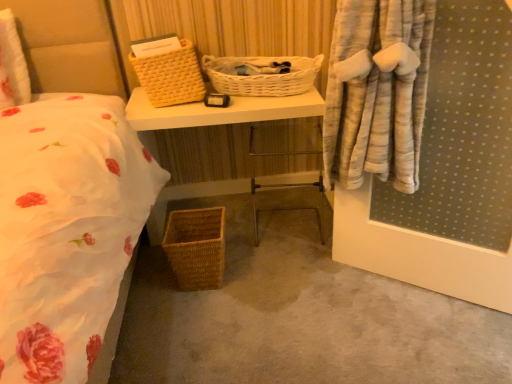
What do you see at coordinates (282, 180) in the screenshot? The width and height of the screenshot is (512, 384). I see `metallic silver chair at center` at bounding box center [282, 180].

This screenshot has height=384, width=512. What do you see at coordinates (196, 247) in the screenshot?
I see `woven brown picnic basket at lower center, the third picnic basket viewed from the top` at bounding box center [196, 247].

The height and width of the screenshot is (384, 512). What do you see at coordinates (218, 112) in the screenshot? I see `matte wicker basket at center` at bounding box center [218, 112].

What is the approximate height of matte wicker basket at center?

matte wicker basket at center is 65.58 centimeters tall.

What do you see at coordinates (170, 76) in the screenshot?
I see `yellow woven picnic basket at upper center, the 3th picnic basket positioned from the bottom` at bounding box center [170, 76].

Image resolution: width=512 pixels, height=384 pixels. Identify the location of metallic silver chair at center. (282, 180).

Is the depth of woven brown picnic basket at lower center, the third picnic basket viewed from the top, greater than that of matte wicker basket at center?

No, woven brown picnic basket at lower center, the third picnic basket viewed from the top, is closer to the viewer.

Does woven brown picnic basket at lower center, the 1th picnic basket from the bottom, have a smaller size compared to matte wicker basket at center?

Indeed, woven brown picnic basket at lower center, the 1th picnic basket from the bottom, has a smaller size compared to matte wicker basket at center.

Considering the relative sizes of woven brown picnic basket at lower center, the 1th picnic basket from the bottom, and matte wicker basket at center in the image provided, is woven brown picnic basket at lower center, the 1th picnic basket from the bottom, shorter than matte wicker basket at center?

Correct, woven brown picnic basket at lower center, the 1th picnic basket from the bottom, is not as tall as matte wicker basket at center.

From a real-world perspective, between woven brown picnic basket at lower center, the 1th picnic basket from the bottom, and matte wicker basket at center, who is vertically higher?

matte wicker basket at center.

Choose the correct answer: Is yellow woven picnic basket at upper center, the 1th picnic basket positioned from the top, inside white wicker picnic basket at center, marked as the second picnic basket in a bottom-to-top arrangement, or outside it?

yellow woven picnic basket at upper center, the 1th picnic basket positioned from the top, is spatially situated outside white wicker picnic basket at center, marked as the second picnic basket in a bottom-to-top arrangement.

What are the coordinates of `the 2nd picnic basket counting from the right side of the yellow woven picnic basket at upper center, the 3th picnic basket positioned from the bottom` in the screenshot? It's located at (261, 76).

Based on their sizes in the image, would you say yellow woven picnic basket at upper center, the 1th picnic basket positioned from the top, is bigger or smaller than white wicker picnic basket at center, the second picnic basket when ordered from top to bottom?

In the image, yellow woven picnic basket at upper center, the 1th picnic basket positioned from the top, appears to be larger than white wicker picnic basket at center, the second picnic basket when ordered from top to bottom.

Considering the relative sizes of yellow woven picnic basket at upper center, the 3th picnic basket positioned from the bottom, and white wicker picnic basket at center, marked as the second picnic basket in a bottom-to-top arrangement, in the image provided, is yellow woven picnic basket at upper center, the 3th picnic basket positioned from the bottom, taller than white wicker picnic basket at center, marked as the second picnic basket in a bottom-to-top arrangement,?

Yes.

Considering the sizes of objects woven basket at lower left and woven brown picnic basket at lower center, the 1th picnic basket from the bottom, in the image provided, who is smaller, woven basket at lower left or woven brown picnic basket at lower center, the 1th picnic basket from the bottom,?

With smaller size is woven brown picnic basket at lower center, the 1th picnic basket from the bottom.

Is woven basket at lower left next to woven brown picnic basket at lower center, the third picnic basket viewed from the top, and touching it?

woven basket at lower left is not next to woven brown picnic basket at lower center, the third picnic basket viewed from the top, and they're not touching.

Which point is more distant from viewer, (181,328) or (212,236)?

Point (212,236)

From a real-world perspective, is woven basket at lower left below woven brown picnic basket at lower center, the 1th picnic basket from the bottom?

Indeed, from a real-world perspective, woven basket at lower left is positioned beneath woven brown picnic basket at lower center, the 1th picnic basket from the bottom.

Where is `concrete below the yellow woven picnic basket at upper center, the 1th picnic basket positioned from the top (from the image's perspective)`? This screenshot has width=512, height=384. concrete below the yellow woven picnic basket at upper center, the 1th picnic basket positioned from the top (from the image's perspective) is located at coordinates (298, 317).

Is woven basket at lower left not within yellow woven picnic basket at upper center, the 3th picnic basket positioned from the bottom?

Yes, woven basket at lower left is located beyond the bounds of yellow woven picnic basket at upper center, the 3th picnic basket positioned from the bottom.

Considering the sizes of objects woven basket at lower left and yellow woven picnic basket at upper center, the 3th picnic basket positioned from the bottom, in the image provided, who is shorter, woven basket at lower left or yellow woven picnic basket at upper center, the 3th picnic basket positioned from the bottom,?

woven basket at lower left.

Looking at this image, can you see matte wicker basket at center touching woven brown picnic basket at lower center, the third picnic basket viewed from the top?

No, matte wicker basket at center is not beside woven brown picnic basket at lower center, the third picnic basket viewed from the top.

From the picture: Can you confirm if matte wicker basket at center is smaller than woven brown picnic basket at lower center, the 1th picnic basket from the bottom?

Actually, matte wicker basket at center might be larger than woven brown picnic basket at lower center, the 1th picnic basket from the bottom.

From the image's perspective, is matte wicker basket at center under woven brown picnic basket at lower center, the 1th picnic basket from the bottom?

No, from the image's perspective, matte wicker basket at center is not beneath woven brown picnic basket at lower center, the 1th picnic basket from the bottom.

Which is closer to the camera, (x=214, y=270) or (x=277, y=83)?

Clearly, point (x=214, y=270) is closer to the camera than point (x=277, y=83).

Is woven brown picnic basket at lower center, the 1th picnic basket from the bottom, not close to white wicker picnic basket at center, marked as the second picnic basket in a bottom-to-top arrangement?

woven brown picnic basket at lower center, the 1th picnic basket from the bottom, is near white wicker picnic basket at center, marked as the second picnic basket in a bottom-to-top arrangement, not far away.

Which is in front, woven brown picnic basket at lower center, the 1th picnic basket from the bottom, or white wicker picnic basket at center, the second picnic basket when ordered from top to bottom?

woven brown picnic basket at lower center, the 1th picnic basket from the bottom, is closer to the camera.

Would you say woven brown picnic basket at lower center, the 1th picnic basket from the bottom, is to the left or to the right of white wicker picnic basket at center, marked as the second picnic basket in a bottom-to-top arrangement, in the picture?

woven brown picnic basket at lower center, the 1th picnic basket from the bottom, is to the left of white wicker picnic basket at center, marked as the second picnic basket in a bottom-to-top arrangement.

Which of these two, yellow woven picnic basket at upper center, the 3th picnic basket positioned from the bottom, or woven basket at lower left, stands taller?

yellow woven picnic basket at upper center, the 3th picnic basket positioned from the bottom, is taller.

Is yellow woven picnic basket at upper center, the 3th picnic basket positioned from the bottom, located outside woven basket at lower left?

Yes, yellow woven picnic basket at upper center, the 3th picnic basket positioned from the bottom, is not within woven basket at lower left.

Is yellow woven picnic basket at upper center, the 3th picnic basket positioned from the bottom, next to woven basket at lower left and touching it?

yellow woven picnic basket at upper center, the 3th picnic basket positioned from the bottom, and woven basket at lower left are clearly separated.

Where is `vanity on the right of woven brown picnic basket at lower center, the 1th picnic basket from the bottom`? This screenshot has height=384, width=512. vanity on the right of woven brown picnic basket at lower center, the 1th picnic basket from the bottom is located at coordinates (218, 112).

Where is `the 1st picnic basket below the yellow woven picnic basket at upper center, the 3th picnic basket positioned from the bottom (from the image's perspective)`? the 1st picnic basket below the yellow woven picnic basket at upper center, the 3th picnic basket positioned from the bottom (from the image's perspective) is located at coordinates (261, 76).

When comparing their distances from metallic silver chair at center, does yellow woven picnic basket at upper center, the 1th picnic basket positioned from the top, or woven basket at lower left seem closer?

woven basket at lower left.

From the image, which object appears to be farther from woven basket at lower left, matte wicker basket at center or yellow woven picnic basket at upper center, the 1th picnic basket positioned from the top?

yellow woven picnic basket at upper center, the 1th picnic basket positioned from the top, is positioned further to the anchor woven basket at lower left.

Estimate the real-world distances between objects in this image. Which object is further from woven basket at lower left, white wicker picnic basket at center, marked as the second picnic basket in a bottom-to-top arrangement, or yellow woven picnic basket at upper center, the 1th picnic basket positioned from the top?

yellow woven picnic basket at upper center, the 1th picnic basket positioned from the top, lies further to woven basket at lower left than the other object.

When comparing their distances from white wicker picnic basket at center, marked as the second picnic basket in a bottom-to-top arrangement, does matte wicker basket at center or woven brown picnic basket at lower center, the 1th picnic basket from the bottom, seem closer?

matte wicker basket at center lies closer to white wicker picnic basket at center, marked as the second picnic basket in a bottom-to-top arrangement, than the other object.

Considering their positions, is matte wicker basket at center positioned closer to woven basket at lower left than woven brown picnic basket at lower center, the third picnic basket viewed from the top?

The object closer to woven basket at lower left is woven brown picnic basket at lower center, the third picnic basket viewed from the top.

Which object lies further to the anchor point matte wicker basket at center, white wicker picnic basket at center, the second picnic basket when ordered from top to bottom, or yellow woven picnic basket at upper center, the 3th picnic basket positioned from the bottom?

white wicker picnic basket at center, the second picnic basket when ordered from top to bottom, is further to matte wicker basket at center.

Consider the image. Which object lies nearer to the anchor point metallic silver chair at center, yellow woven picnic basket at upper center, the 3th picnic basket positioned from the bottom, or white wicker picnic basket at center, marked as the second picnic basket in a bottom-to-top arrangement?

white wicker picnic basket at center, marked as the second picnic basket in a bottom-to-top arrangement, lies closer to metallic silver chair at center than the other object.

Looking at this image, from the image, which object appears to be farther from metallic silver chair at center, white wicker picnic basket at center, the second picnic basket when ordered from top to bottom, or woven basket at lower left?

Among the two, white wicker picnic basket at center, the second picnic basket when ordered from top to bottom, is located further to metallic silver chair at center.

In order to click on chair between woven brown picnic basket at lower center, the third picnic basket viewed from the top, and woven basket at lower left from left to right in this screenshot , I will do `click(282, 180)`.

Where is `chair that lies between yellow woven picnic basket at upper center, the 3th picnic basket positioned from the bottom, and woven brown picnic basket at lower center, the 1th picnic basket from the bottom, from top to bottom`? Image resolution: width=512 pixels, height=384 pixels. chair that lies between yellow woven picnic basket at upper center, the 3th picnic basket positioned from the bottom, and woven brown picnic basket at lower center, the 1th picnic basket from the bottom, from top to bottom is located at coordinates (282, 180).

Where is `chair between matte wicker basket at center and woven brown picnic basket at lower center, the third picnic basket viewed from the top, from top to bottom`? chair between matte wicker basket at center and woven brown picnic basket at lower center, the third picnic basket viewed from the top, from top to bottom is located at coordinates (282, 180).

The height and width of the screenshot is (384, 512). Identify the location of vanity located between yellow woven picnic basket at upper center, the 1th picnic basket positioned from the top, and white wicker picnic basket at center, the second picnic basket when ordered from top to bottom, in the left-right direction. (218, 112).